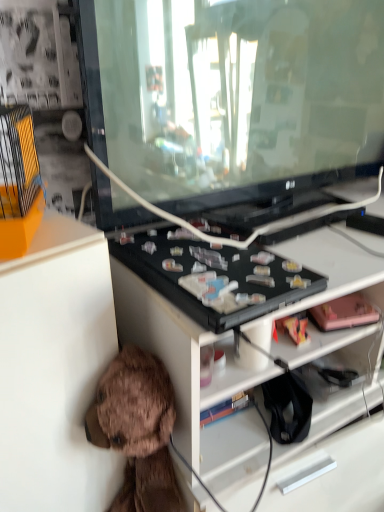
Question: Is brown plush toy at lower left, positioned as the 2th toy in top-to-bottom order, surrounding transparent glass tv at center?

Choices:
 (A) yes
 (B) no

Answer: (B)

Question: From a real-world perspective, is brown plush toy at lower left, marked as the first toy in a bottom-to-top arrangement, over transparent glass tv at center?

Choices:
 (A) yes
 (B) no

Answer: (B)

Question: From the image's perspective, is brown plush toy at lower left, positioned as the 2th toy in top-to-bottom order, beneath transparent glass tv at center?

Choices:
 (A) no
 (B) yes

Answer: (B)

Question: Is transparent glass tv at center at the back of brown plush toy at lower left, the 2th toy positioned from the right?

Choices:
 (A) no
 (B) yes

Answer: (A)

Question: Is brown plush toy at lower left, positioned as the 2th toy in top-to-bottom order, to the left of transparent glass tv at center from the viewer's perspective?

Choices:
 (A) no
 (B) yes

Answer: (B)

Question: Is brown plush toy at lower left, positioned as the 2th toy in top-to-bottom order, oriented towards white matte cabinet at lower left?

Choices:
 (A) yes
 (B) no

Answer: (B)

Question: Does brown plush toy at lower left, marked as the first toy in a bottom-to-top arrangement, come in front of white matte cabinet at lower left?

Choices:
 (A) no
 (B) yes

Answer: (A)

Question: Is white matte cabinet at lower left at the back of brown plush toy at lower left, which is the 1th toy in left-to-right order?

Choices:
 (A) yes
 (B) no

Answer: (A)

Question: Can you confirm if brown plush toy at lower left, marked as the first toy in a bottom-to-top arrangement, is wider than white matte cabinet at lower left?

Choices:
 (A) no
 (B) yes

Answer: (A)

Question: Can you confirm if brown plush toy at lower left, which is the 1th toy in left-to-right order, is taller than white matte cabinet at lower left?

Choices:
 (A) no
 (B) yes

Answer: (A)

Question: Is the position of brown plush toy at lower left, positioned as the 2th toy in top-to-bottom order, more distant than that of white matte cabinet at lower left?

Choices:
 (A) no
 (B) yes

Answer: (B)

Question: Would you say pink matte toy at right, placed as the 2th toy when sorted from left to right, is part of brown plush toy at lower left, positioned as the 2th toy in top-to-bottom order,'s contents?

Choices:
 (A) yes
 (B) no

Answer: (B)